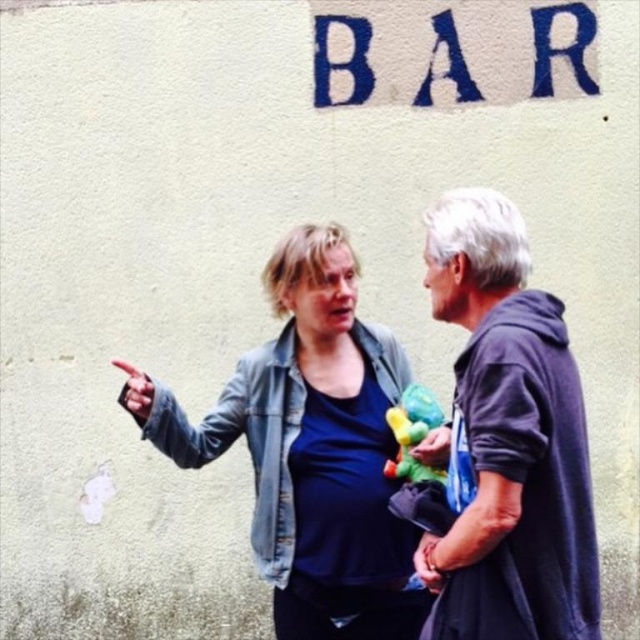
In the scene shown: You are trying to locate the denim jacket at upper left in the image. What are the coordinates where you should look?

The denim jacket at upper left can be found at coordinates point (310,449).

You are standing in front of the wall with the word BAR painted on it. You see a point marked at coordinates (296,577). If you want to touch this point with a 2.5 meter long pole, will you be able to reach it?

The point at coordinates (296,577) is 3.22 meters away from the camera. Since the pole is 2.5 meters long, you cannot reach the point with the pole as it is shorter than the required distance.

You are trying to determine the spatial relationship between the dark gray hoodie at right and the multicolored plush toy at center. Based on the scene description, which object is located above the other?

The dark gray hoodie at right is positioned over the multicolored plush toy at center, meaning it is located above the plush toy.